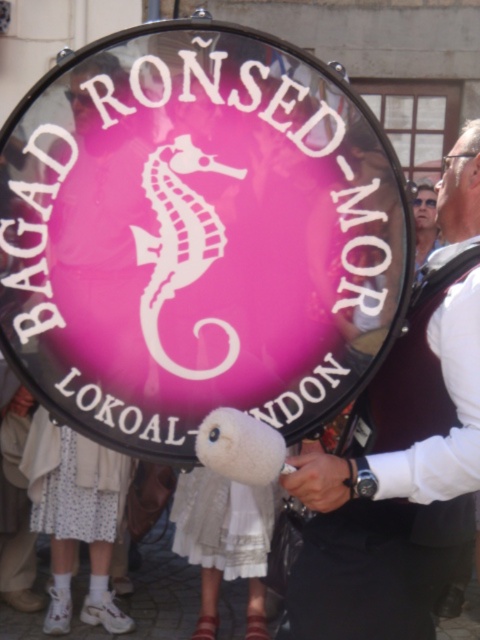
Question: Which point is closer to the camera taking this photo?

Choices:
 (A) (351, 568)
 (B) (140, 320)

Answer: (B)

Question: Which of the following is the closest to the observer?

Choices:
 (A) (211, 246)
 (B) (262, 470)

Answer: (B)

Question: Can you confirm if pink glossy drum at center is positioned to the right of white fabric vest at center?

Choices:
 (A) no
 (B) yes

Answer: (A)

Question: Is white fabric vest at center to the left of white fluffy animal at center from the viewer's perspective?

Choices:
 (A) no
 (B) yes

Answer: (A)

Question: Is white plastic seahorse at center thinner than white fluffy animal at center?

Choices:
 (A) yes
 (B) no

Answer: (B)

Question: Which of the following is the farthest from the observer?

Choices:
 (A) white fluffy animal at center
 (B) pink glossy drum at center
 (C) white fabric vest at center
 (D) white plastic seahorse at center

Answer: (D)